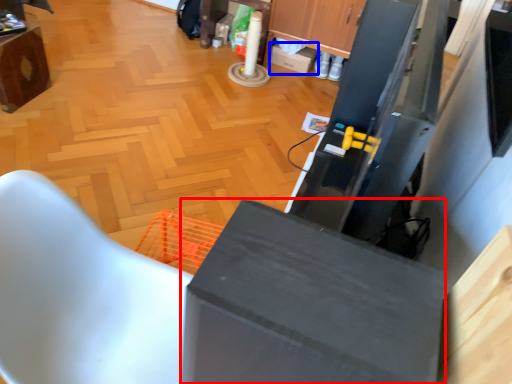
Question: Among these objects, which one is nearest to the camera, cabinetry (highlighted by a red box) or box (highlighted by a blue box)?

Choices:
 (A) cabinetry
 (B) box

Answer: (A)